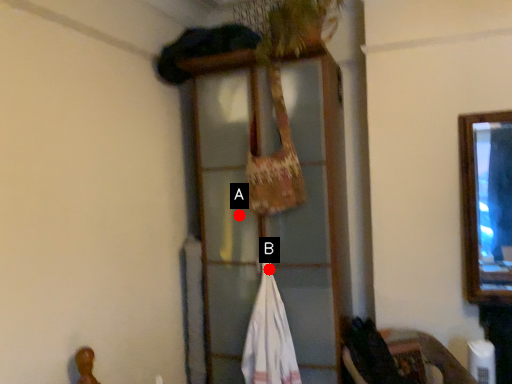
Question: Two points are circled on the image, labeled by A and B beside each circle. Which point is closer to the camera?

Choices:
 (A) A is closer
 (B) B is closer

Answer: (B)